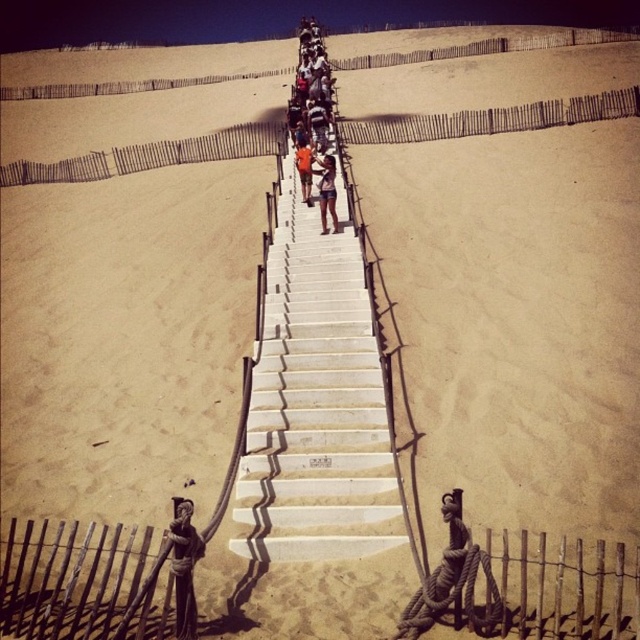
You are standing on the sand near the white concrete stairs at center and want to take a photo of the wooden statue at center. Where should you position yourself relative to the stairs to ensure the statue is fully visible in your shot?

The wooden statue at center is behind the white concrete stairs at center, so you should position yourself behind the white concrete stairs at center to ensure the wooden statue at center is fully visible in your shot.